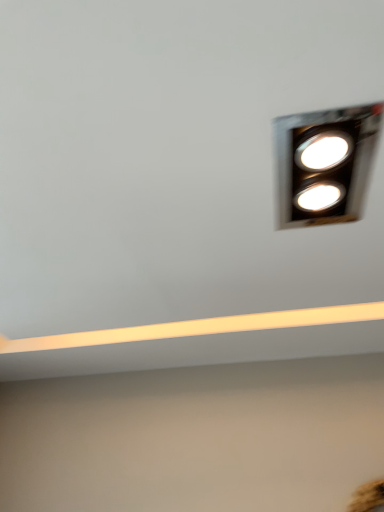
Describe the element at coordinates (324, 164) in the screenshot. The height and width of the screenshot is (512, 384). I see `white glossy light fixture at upper right` at that location.

Locate an element on the screen. white glossy light fixture at upper right is located at coordinates 324,164.

At what (x,y) coordinates should I click in order to perform the action: click on white glossy light fixture at upper right. Please return your answer as a coordinate pair (x, y). Looking at the image, I should click on (324, 164).